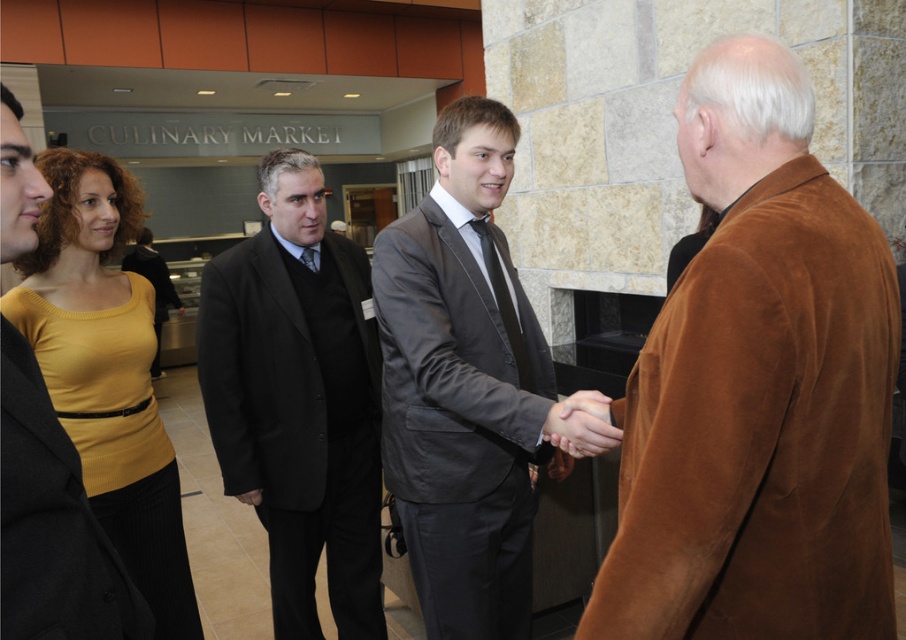
Is point (811, 406) in front of point (439, 316)?

That is True.

Can you confirm if brown suede jacket at right is positioned below gray suit at center?

No, brown suede jacket at right is not below gray suit at center.

Where is `brown suede jacket at right`? This screenshot has height=640, width=906. brown suede jacket at right is located at coordinates (758, 388).

The image size is (906, 640). Identify the location of brown suede jacket at right. (758, 388).

Which of these two, black wool suit at center or yellow knit top at upper left, stands taller?

black wool suit at center

Does point (275, 307) lie behind point (191, 605)?

Yes, point (275, 307) is farther from viewer.

This screenshot has width=906, height=640. Describe the element at coordinates (297, 400) in the screenshot. I see `black wool suit at center` at that location.

This screenshot has height=640, width=906. Find the location of `black wool suit at center`. black wool suit at center is located at coordinates (297, 400).

Does smooth leather hand at center appear under black silk tie at center?

Indeed, smooth leather hand at center is positioned under black silk tie at center.

Image resolution: width=906 pixels, height=640 pixels. I want to click on smooth leather hand at center, so click(581, 424).

Is point (562, 412) positioned in front of point (490, 284)?

That is True.

Where is `smooth leather hand at center`? smooth leather hand at center is located at coordinates (581, 424).